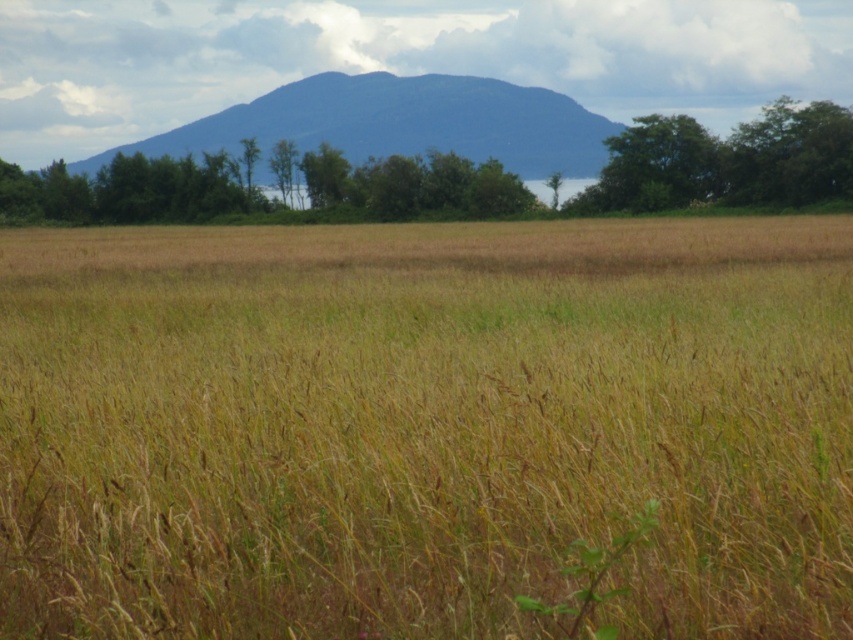
You are standing in the meadow looking towards the hill. You notice the brown grass at center and the green leafy tree at upper right. Which object is taller?

The green leafy tree at upper right is taller than the brown grass at center.